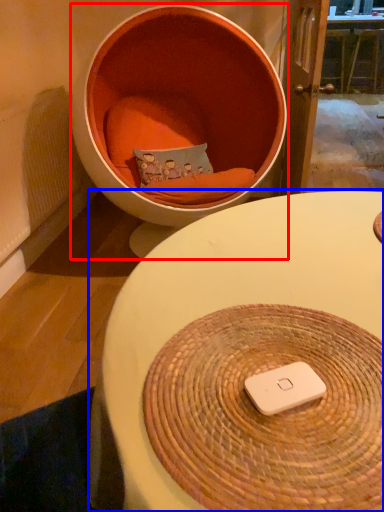
Question: Which object is further to the camera taking this photo, furniture (highlighted by a red box) or table (highlighted by a blue box)?

Choices:
 (A) furniture
 (B) table

Answer: (A)